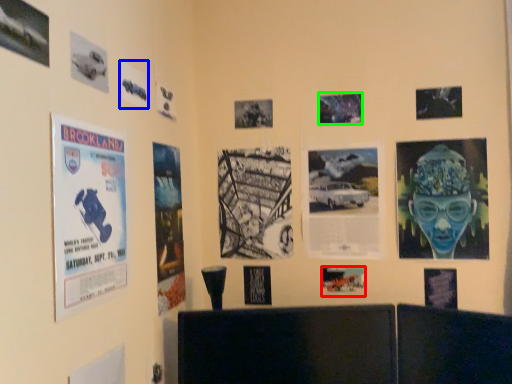
Question: Based on their relative distances, which object is farther from poster (highlighted by a red box)? Choose from poster (highlighted by a blue box) and poster (highlighted by a green box).

Choices:
 (A) poster
 (B) poster

Answer: (A)